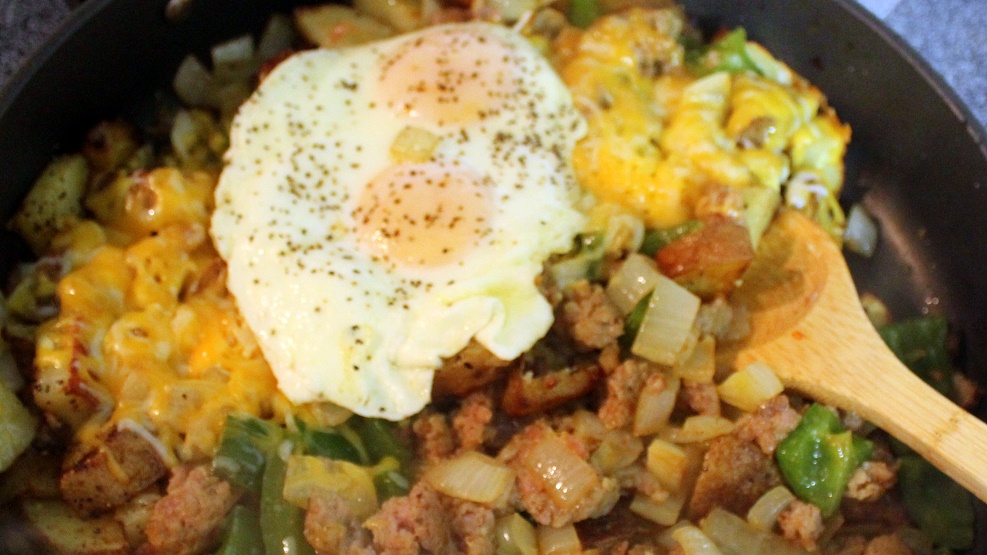
Locate an element on the screen. spoon is located at coordinates (823, 332).